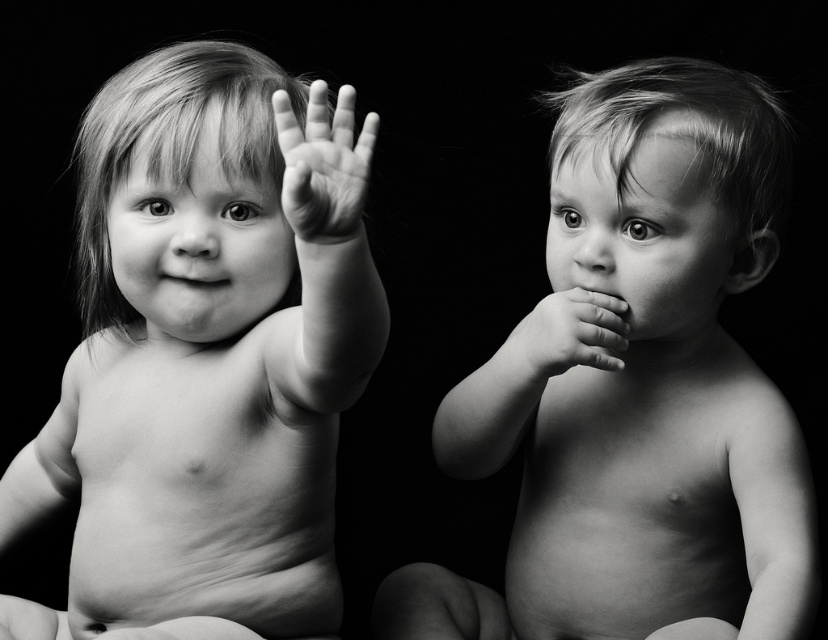
In the black and white photo, there are two children sitting side by side. The child on the left has light hair and is waving their right hand above shoulder level. The child on the right has darker hair and holds their hand near their mouth. There is a specific point at coordinates point (323, 164). What object is located at that point?

The point (323, 164) has smooth skin hand at center.

You are a photographer analyzing the composition of this black and white photo. You notice a smooth skin hand at center. Where exactly is this hand located in terms of coordinates?

The smooth skin hand at center is located at coordinates point [323,164].

You are standing 30 inches away from a large black and white photograph. The image has a point located at coordinates point (355, 148). If you want to touch this point on the photograph, will you be able to reach it without moving closer?

The point (355, 148) is 24.99 inches away from the viewer. Since you are standing 30 inches away, you are farther than the required distance. Therefore, you can reach the point without moving closer.